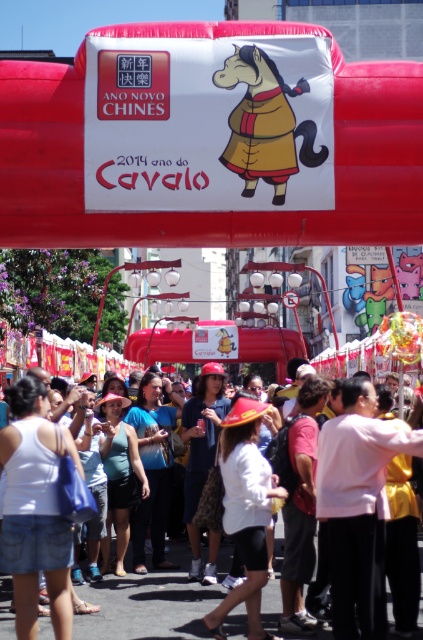
Is matte red inflatable horse at center taller than white cotton crowd at center?

Correct, matte red inflatable horse at center is much taller as white cotton crowd at center.

Consider the image. Between matte red inflatable horse at center and white cotton crowd at center, which one has less height?

white cotton crowd at center is shorter.

Is point (393, 88) positioned in front of point (128, 612)?

No.

I want to click on matte red inflatable horse at center, so click(211, 209).